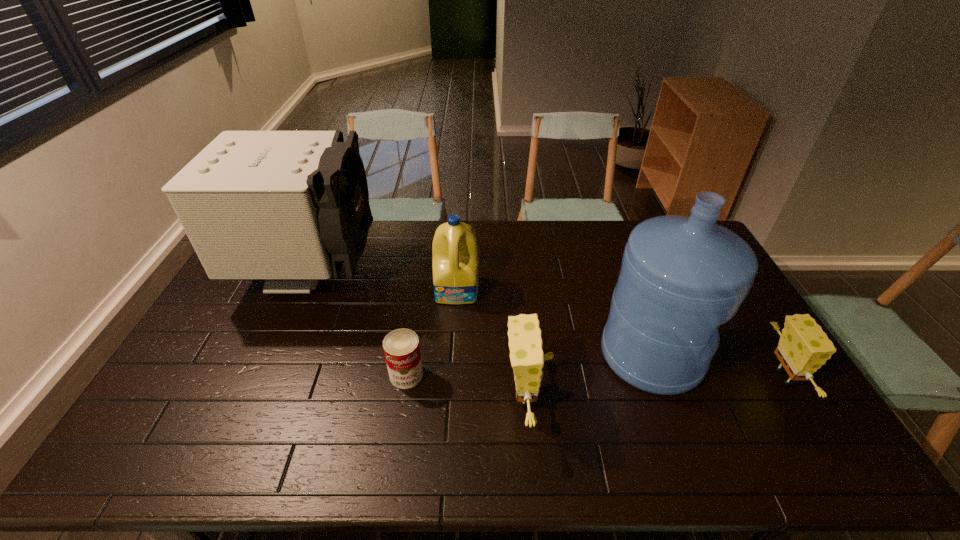
The height and width of the screenshot is (540, 960). I want to click on free point that keeps the sponges evenly spaced on the left, so click(247, 417).